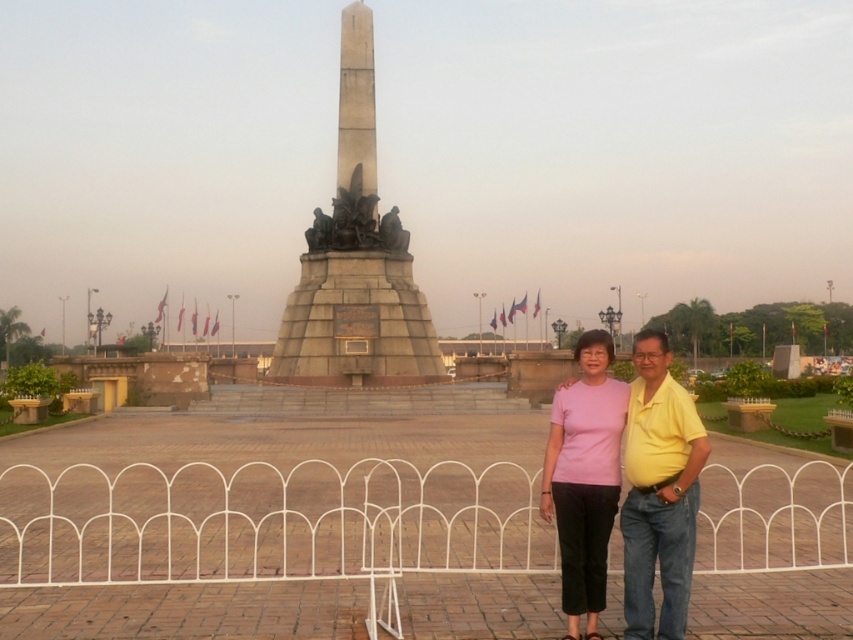
Looking at this image, does white metal fence at center have a lesser width compared to gray stone monument at center?

No.

Can you confirm if white metal fence at center is positioned to the left of gray stone monument at center?

In fact, white metal fence at center is to the right of gray stone monument at center.

Which is behind, point (94, 516) or point (344, 65)?

The point (344, 65) is more distant.

Locate an element on the screen. white metal fence at center is located at coordinates (267, 522).

Does white metal fence at center have a greater width compared to pink matte shirt at center?

Yes.

Can you confirm if white metal fence at center is bigger than pink matte shirt at center?

Yes, white metal fence at center is bigger than pink matte shirt at center.

Is point (184, 557) positioned in front of point (659, 637)?

That is False.

I want to click on white metal fence at center, so click(267, 522).

What do you see at coordinates (357, 260) in the screenshot? I see `gray stone monument at center` at bounding box center [357, 260].

Is gray stone monument at center to the left of pink matte shirt at center from the viewer's perspective?

Correct, you'll find gray stone monument at center to the left of pink matte shirt at center.

You are a GUI agent. You are given a task and a screenshot of the screen. Output one action in this format:
    pyautogui.click(x=<x>, y=<y>)
    Task: Click on the gray stone monument at center
    The height and width of the screenshot is (640, 853).
    Given the screenshot: What is the action you would take?
    [x=357, y=260]